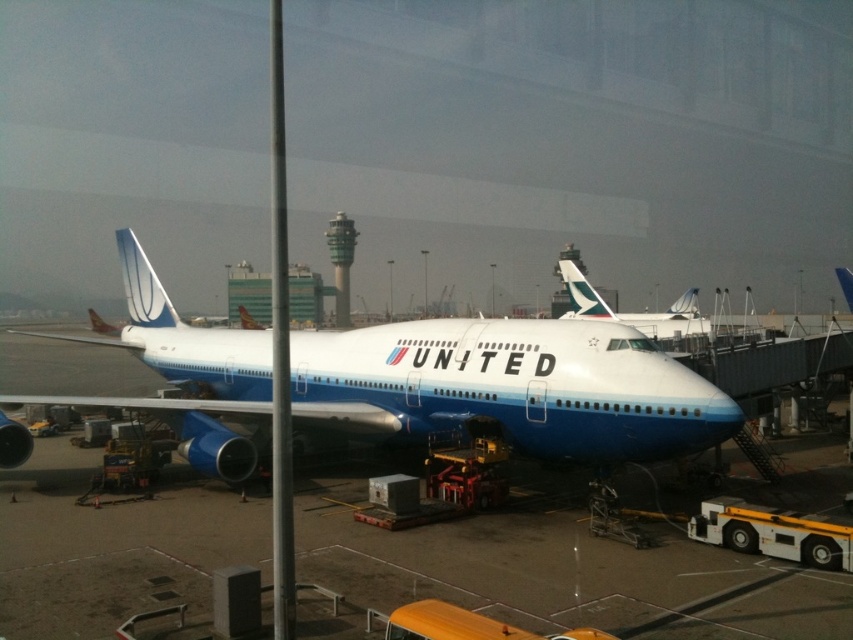
Where is the white glossy airplane at center located in the image?

The white glossy airplane at center is located at point 0.605 on the x axis and 0.599 on the y axis.

You are an airport maintenance worker checking the dimensions of the airplanes. You see the white glossy airplane at center and the blue polished airplane at center. Which airplane has a shorter length?

The white glossy airplane at center is shorter than the blue polished airplane at center.

You are an airport staff member checking the gate. You see a white glossy airplane at center and a blue polished airplane at center. Which airplane has a greater width?

The white glossy airplane at center has a greater width than the blue polished airplane at center according to the description.